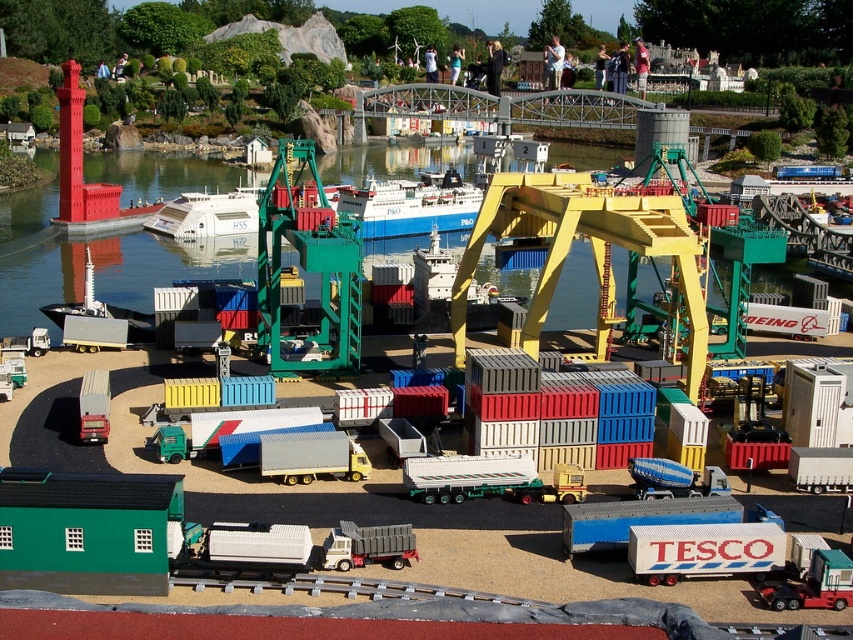
Which of these two, green metallic crane at center or white plastic boat at center, stands shorter?

white plastic boat at center

Does green metallic crane at center appear under white plastic boat at center?

Correct, green metallic crane at center is located below white plastic boat at center.

Does point (358, 248) lie behind point (413, 211)?

That is False.

You are a GUI agent. You are given a task and a screenshot of the screen. Output one action in this format:
    pyautogui.click(x=<x>, y=<y>)
    Task: Click on the green metallic crane at center
    This screenshot has width=853, height=640.
    Given the screenshot: What is the action you would take?
    pyautogui.click(x=306, y=268)

Does green metallic crane at center have a greater height compared to blue matte container ship at center?

Correct, green metallic crane at center is much taller as blue matte container ship at center.

This screenshot has width=853, height=640. I want to click on green metallic crane at center, so click(306, 268).

Can you confirm if white plastic boat at center is shorter than metallic silver truck at center?

Incorrect, white plastic boat at center's height does not fall short of metallic silver truck at center's.

Which is above, white plastic boat at center or metallic silver truck at center?

white plastic boat at center is above.

Between point (202, 209) and point (350, 529), which one is positioned behind?

Positioned behind is point (202, 209).

Locate an element on the screen. Image resolution: width=853 pixels, height=640 pixels. white plastic boat at center is located at coordinates (408, 204).